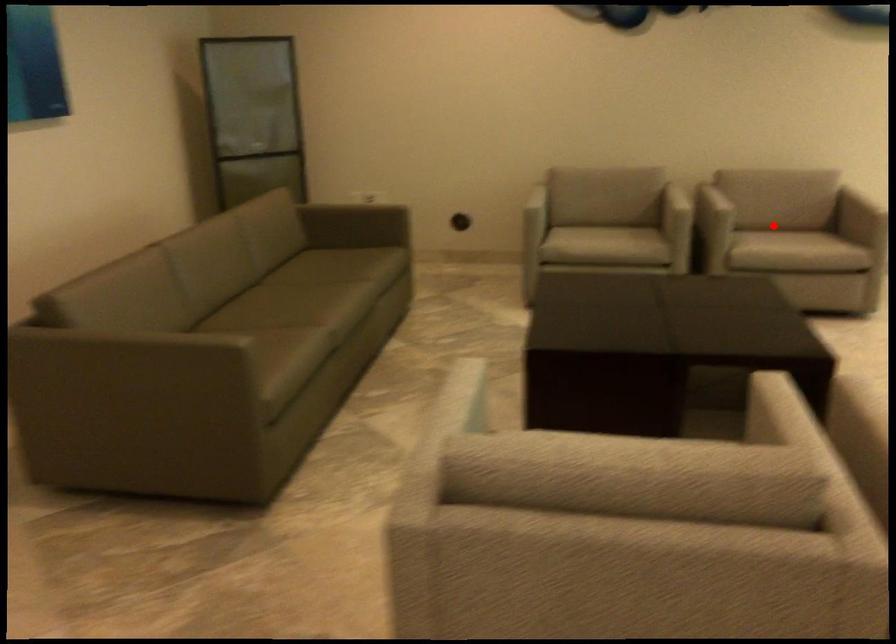
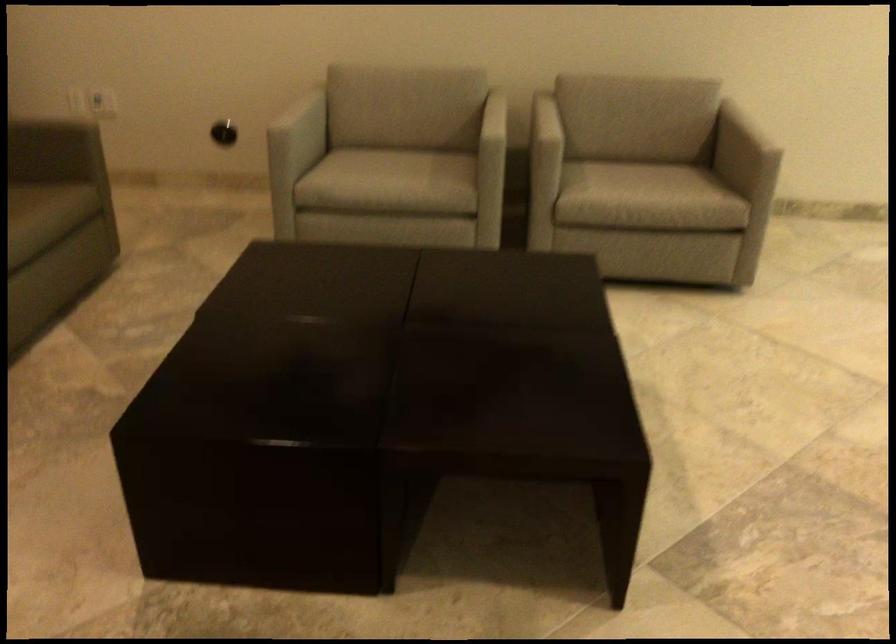
Question: I am providing you with two images of the same scene from different viewpoints. In image1, a red point is highlighted. Considering the same 3D point in image2, which of the following is correct?

Choices:
 (A) It is closer
 (B) It is farther

Answer: (A)